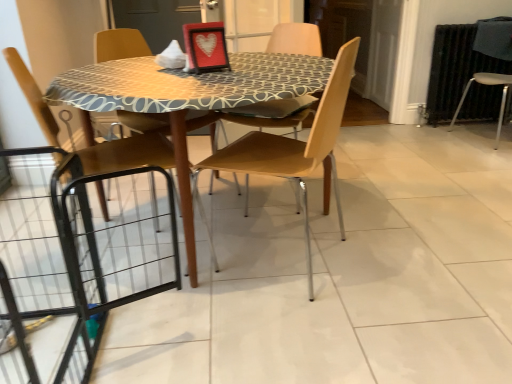
You are a GUI agent. You are given a task and a screenshot of the screen. Output one action in this format:
    pyautogui.click(x=<x>, y=<y>)
    Task: Click on the free location to the right of wooden chair at center, the second chair positioned from the left
    
    Given the screenshot: What is the action you would take?
    pyautogui.click(x=384, y=261)